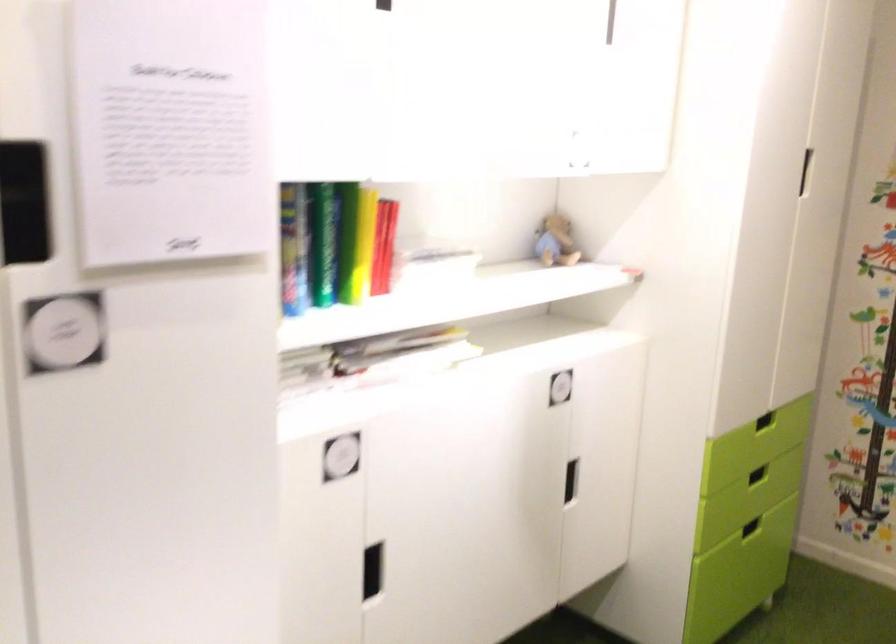
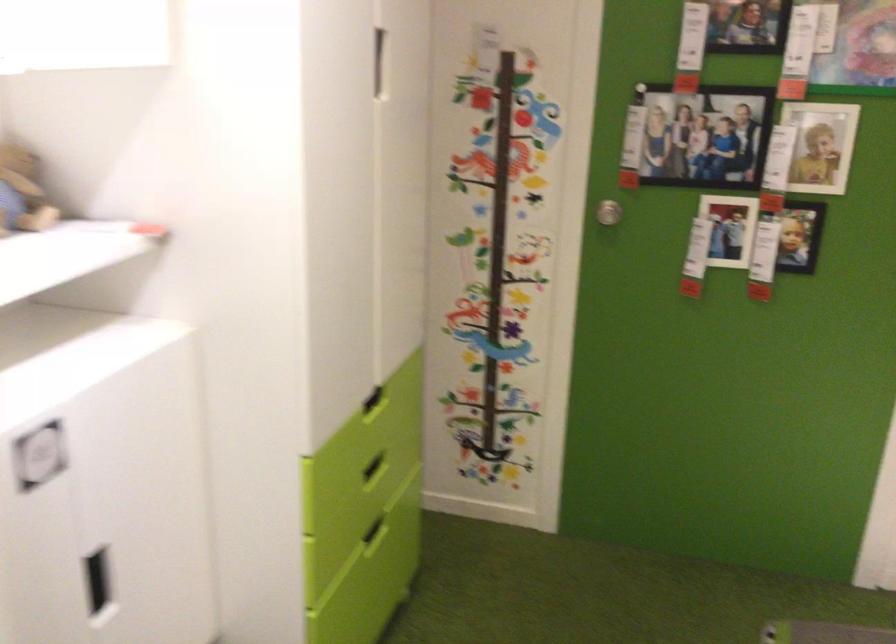
Locate, in the second image, the point that corresponds to (x=761, y=471) in the first image.

(374, 468)